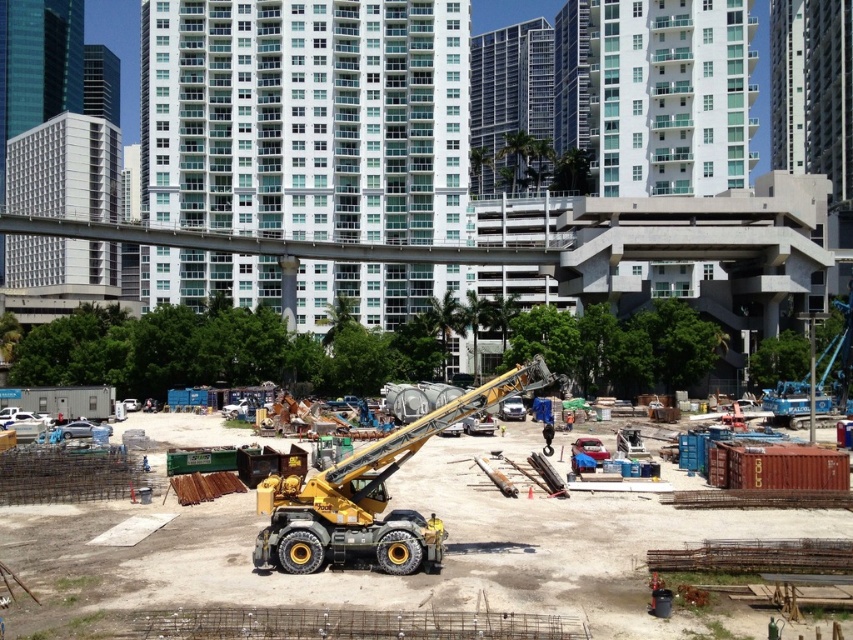
Is yellow metallic crane at center closer to camera compared to yellow metallic excavator at center?

Yes, yellow metallic crane at center is in front of yellow metallic excavator at center.

Does yellow metallic crane at center have a larger size compared to yellow metallic excavator at center?

Yes, yellow metallic crane at center is bigger than yellow metallic excavator at center.

Find the location of `yellow metallic crane at center`. yellow metallic crane at center is located at coordinates (376, 572).

Locate an element on the screen. Image resolution: width=853 pixels, height=640 pixels. yellow metallic crane at center is located at coordinates (376, 572).